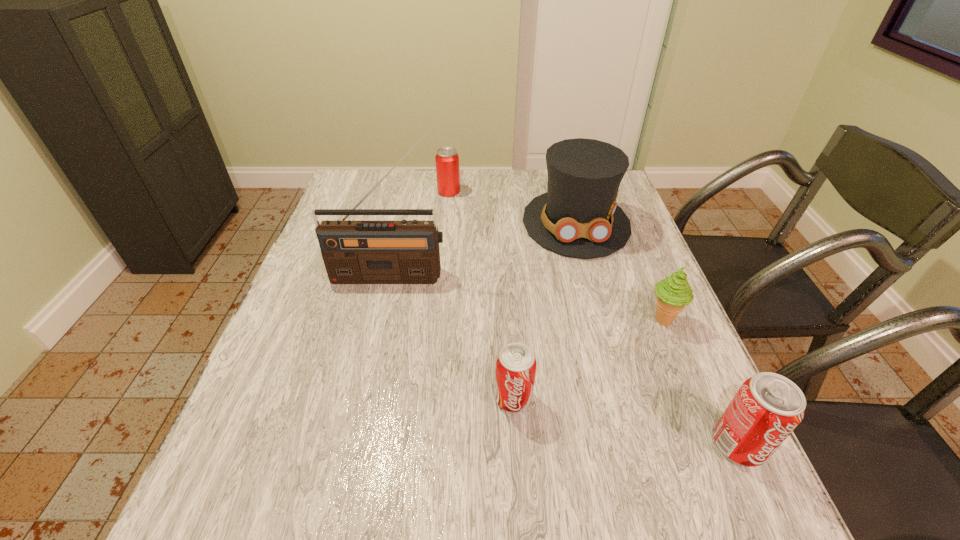
All soda cans are currently evenly spaced. To continue this pattern, where would you add another soda can on the left? Please point out a vacant spot. Please provide its 2D coordinates. Your answer should be formatted as a tuple, i.e. [(x, y)], where the tuple contains the x and y coordinates of a point satisfying the conditions above.

[(323, 359)]